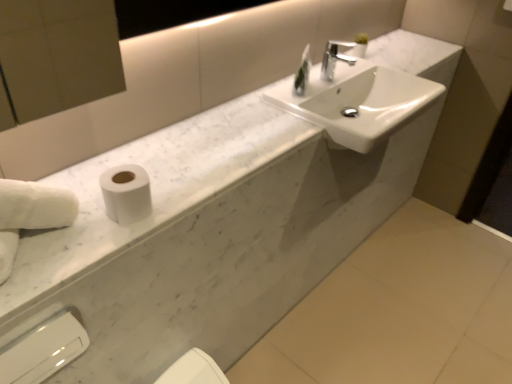
Where is `vacant space situated on the left part of white matte toilet paper at left`? vacant space situated on the left part of white matte toilet paper at left is located at coordinates (84, 193).